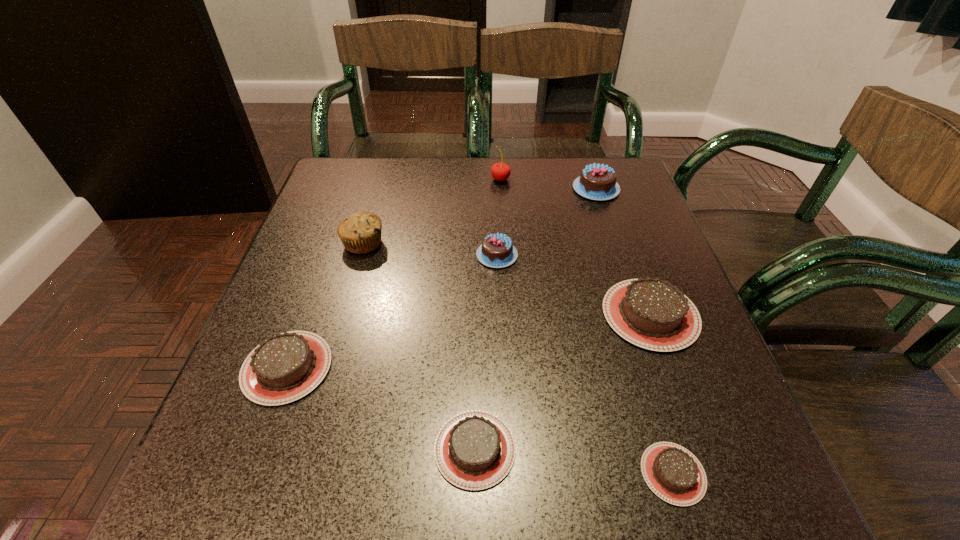
Locate an element on the screen. vacant area situated on the right of the second brown chocolate cake from left to right is located at coordinates (718, 449).

Where is `vacant region located on the back of the shortest chocolate cake`? vacant region located on the back of the shortest chocolate cake is located at coordinates (636, 349).

The image size is (960, 540). In order to click on cherry located in the far edge section of the desktop in this screenshot , I will do `click(500, 171)`.

At what (x,y) coordinates should I click in order to perform the action: click on chocolate cake situated at the far edge. Please return your answer as a coordinate pair (x, y). This screenshot has height=540, width=960. Looking at the image, I should click on (597, 182).

This screenshot has height=540, width=960. What are the coordinates of `muffin situated at the left edge` in the screenshot? It's located at (360, 233).

Where is `chocolate cake positioned at the left edge`? Image resolution: width=960 pixels, height=540 pixels. chocolate cake positioned at the left edge is located at coordinates (284, 368).

Identify the location of object positioned at the far right corner. The image size is (960, 540). (597, 182).

The width and height of the screenshot is (960, 540). Identify the location of object that is at the near right corner. (673, 473).

Find the location of a particular element. The width and height of the screenshot is (960, 540). free location at the far edge is located at coordinates (441, 178).

Identify the location of free space at the left edge of the desktop. (263, 339).